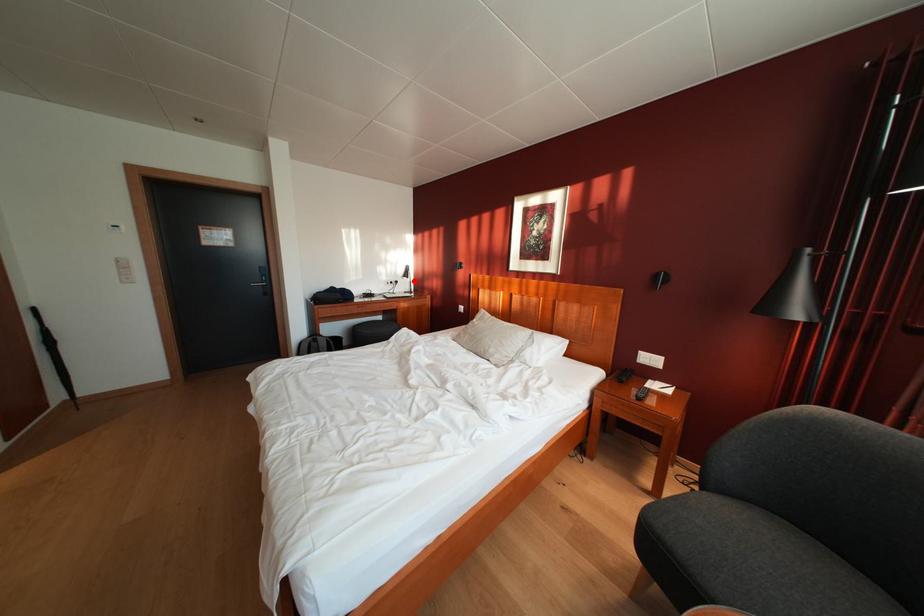
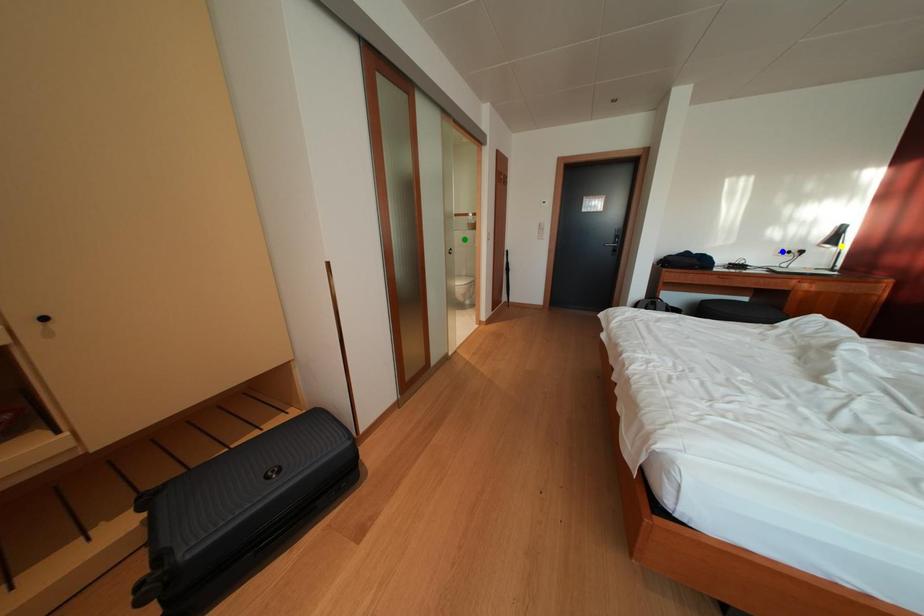
Question: I am providing you with two images of the same scene from different viewpoints. A red point is marked on the first image. You are given multiple points on the second image. Can you choose the point in image 2 that corresponds to the point in image 1?

Choices:
 (A) yellow point
 (B) green point
 (C) blue point

Answer: (A)